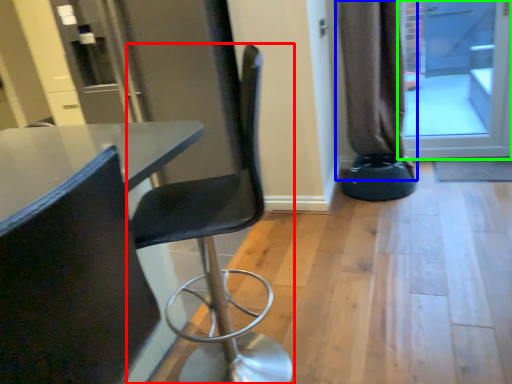
Question: Which object is the farthest from chair (highlighted by a red box)? Choose among these: curtain (highlighted by a blue box) or screen door (highlighted by a green box).

Choices:
 (A) curtain
 (B) screen door

Answer: (B)